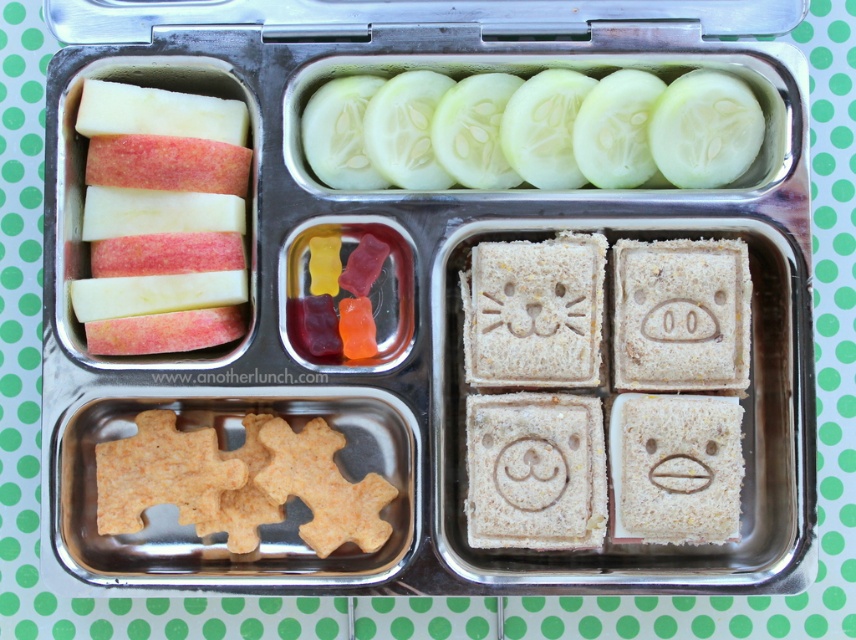
Is green cucumber slices at upper center above red matte apple at left?

Yes, green cucumber slices at upper center is above red matte apple at left.

Who is more forward, (429, 179) or (159, 131)?

Point (159, 131) is more forward.

The height and width of the screenshot is (640, 856). I want to click on green cucumber slices at upper center, so click(530, 131).